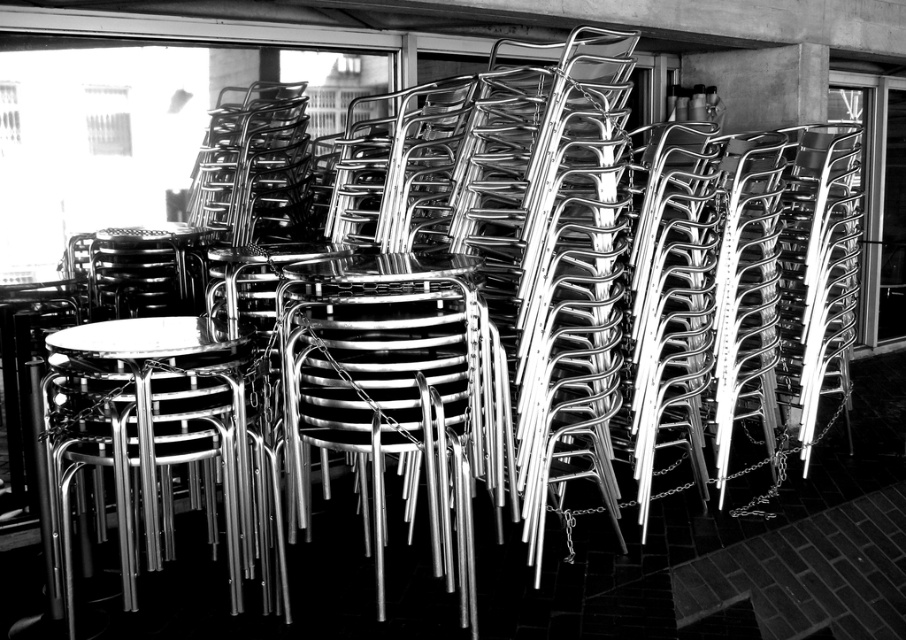
From the picture: You are standing at the origin point of the image coordinate system. You need to locate the metallic silver chair at center. What are its coordinates?

The metallic silver chair at center is located at coordinates point (397, 401).

Consider the image. You are a maintenance worker who needs to store the metallic silver chair at center and the polished metal table at center. If you want to place them vertically in a storage room with a height limit of 1.5 meters, which object might exceed the height limit?

The metallic silver chair at center is much taller than the polished metal table at center, so it might exceed the height limit of 1.5 meters.